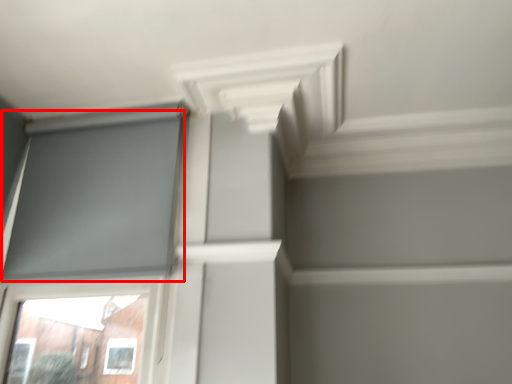
Question: From the image's perspective, considering the relative positions of window screen (annotated by the red box) and exhaust hood in the image provided, where is window screen (annotated by the red box) located with respect to the staircase?

Choices:
 (A) above
 (B) below

Answer: (B)